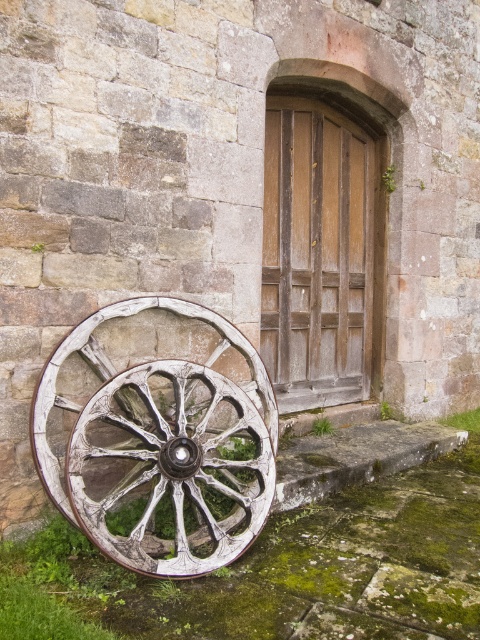
Locate an element on the screen. This screenshot has width=480, height=640. white wooden wagon wheel at lower left is located at coordinates (159, 436).

Does white wooden wagon wheel at lower left come in front of wooden door at center?

That is True.

Identify the location of white wooden wagon wheel at lower left. (159, 436).